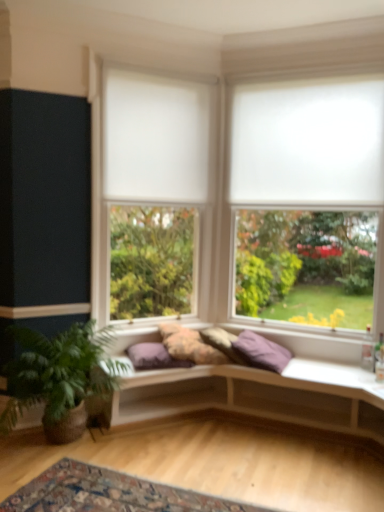
Identify the location of vacant point above white matte curtain at upper center (from a real-world perspective). The height and width of the screenshot is (512, 384). (163, 74).